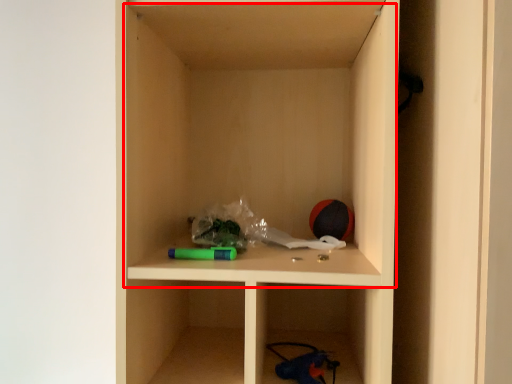
Question: From the image's perspective, what is the correct spatial relationship of cabinet (annotated by the red box) in relation to toy?

Choices:
 (A) above
 (B) below

Answer: (A)